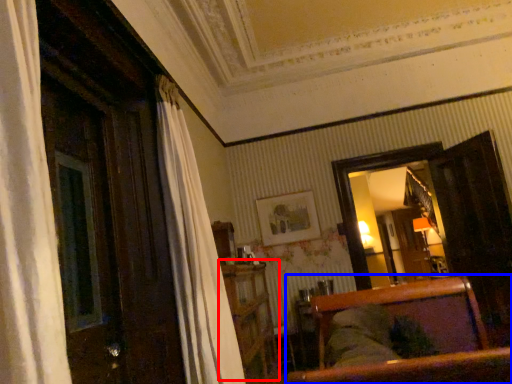
Question: Among these objects, which one is nearest to the camera, dresser (highlighted by a red box) or furniture (highlighted by a blue box)?

Choices:
 (A) dresser
 (B) furniture

Answer: (B)